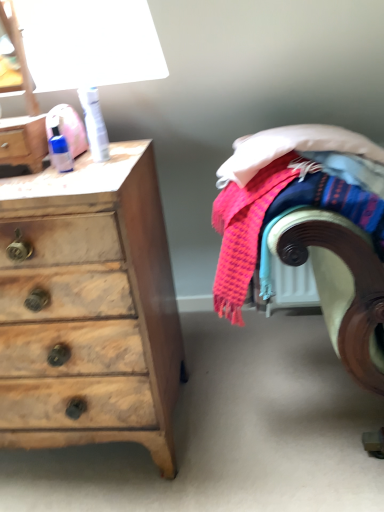
Question: Is matte plastic bottle at upper left spatially inside wooden chest of drawers at left, or outside of it?

Choices:
 (A) outside
 (B) inside

Answer: (A)

Question: From a real-world perspective, is matte plastic bottle at upper left positioned above or below wooden chest of drawers at left?

Choices:
 (A) below
 (B) above

Answer: (B)

Question: Based on their relative distances, which object is farther from the wooden chest of drawers at left?

Choices:
 (A) textured woolen blanket at right
 (B) matte plastic bottle at upper left
 (C) white plastic can at upper left, placed as the first toiletry when sorted from right to left
 (D) blue plastic bottle at upper left, which is counted as the 2th toiletry, starting from the right

Answer: (D)

Question: Based on their relative distances, which object is nearer to the blue plastic bottle at upper left, which is counted as the 2th toiletry, starting from the right?

Choices:
 (A) matte plastic bottle at upper left
 (B) wooden chest of drawers at left
 (C) white plastic can at upper left, arranged as the second toiletry when viewed from the left
 (D) textured woolen blanket at right

Answer: (A)